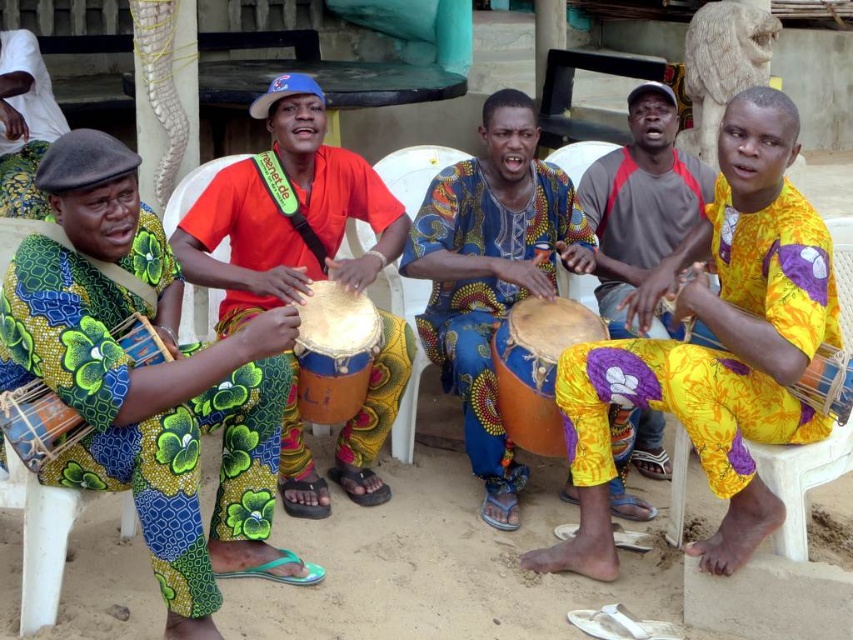
You are a photographer setting up for a group photo. You need to position a camera tripod between the green floral fabric drum at left and the blue patterned cloth at center. Since the tripod requires a flat surface, will the space between them be stable enough?

The green floral fabric drum at left is shorter than the blue patterned cloth at center, so the space between them may not be entirely flat. However, since both objects are on the sandy ground, the sand itself can be leveled to create a stable base for the tripod.

You are organizing a music performance and need to place the green floral fabric drum at left and the blue patterned cloth at center on a stage. Given their sizes, which one should be placed on the left side of the stage to ensure visibility?

The green floral fabric drum at left is bigger than the blue patterned cloth at center, so placing the larger drum on the left side of the stage will ensure it is visible to the audience.